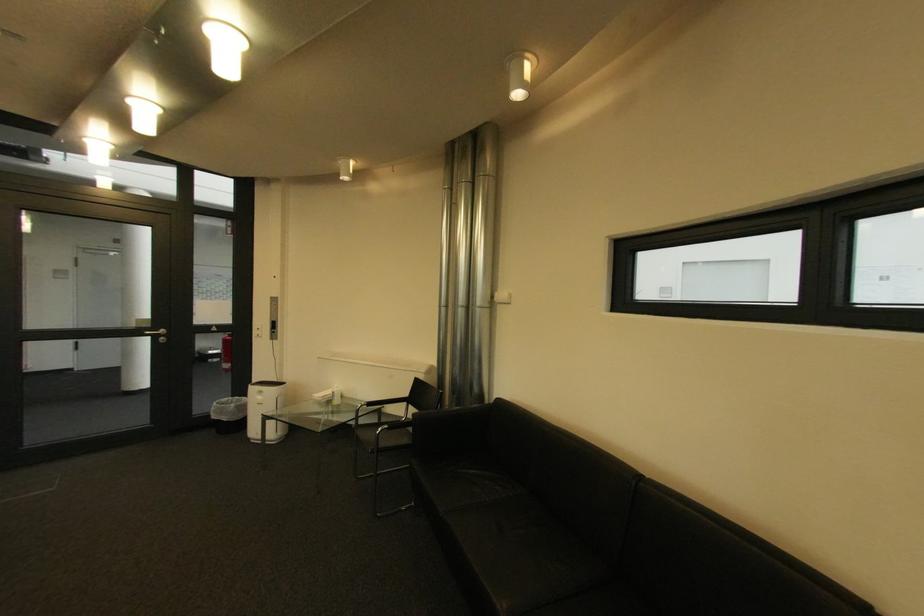
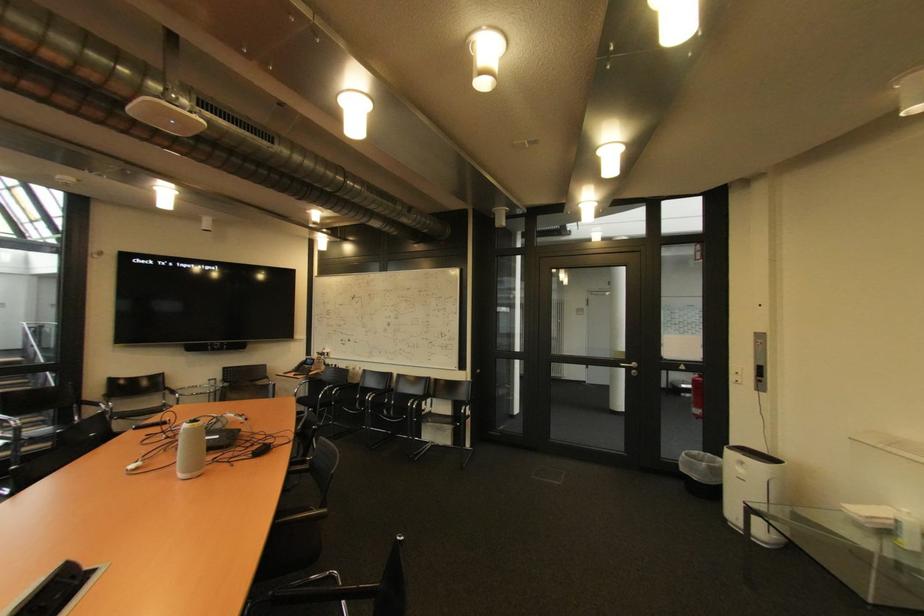
Where in the second image is the point corresponding to pixel 268 399 from the first image?

(748, 471)